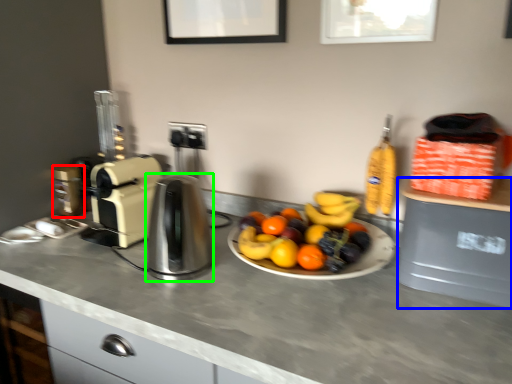
Question: Based on their relative distances, which object is nearer to coffee machine (highlighted by a red box)? Choose from appliance (highlighted by a blue box) and kitchen appliance (highlighted by a green box).

Choices:
 (A) appliance
 (B) kitchen appliance

Answer: (B)